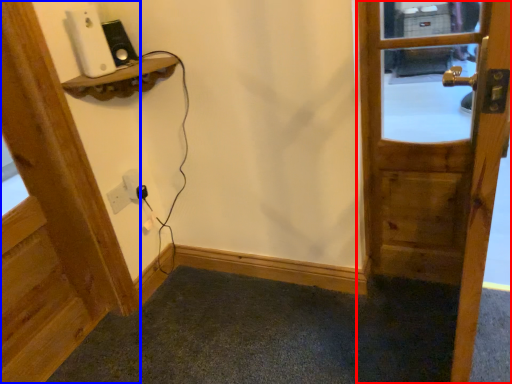
Question: Which point is further to the camera, door (highlighted by a red box) or door (highlighted by a blue box)?

Choices:
 (A) door
 (B) door

Answer: (B)